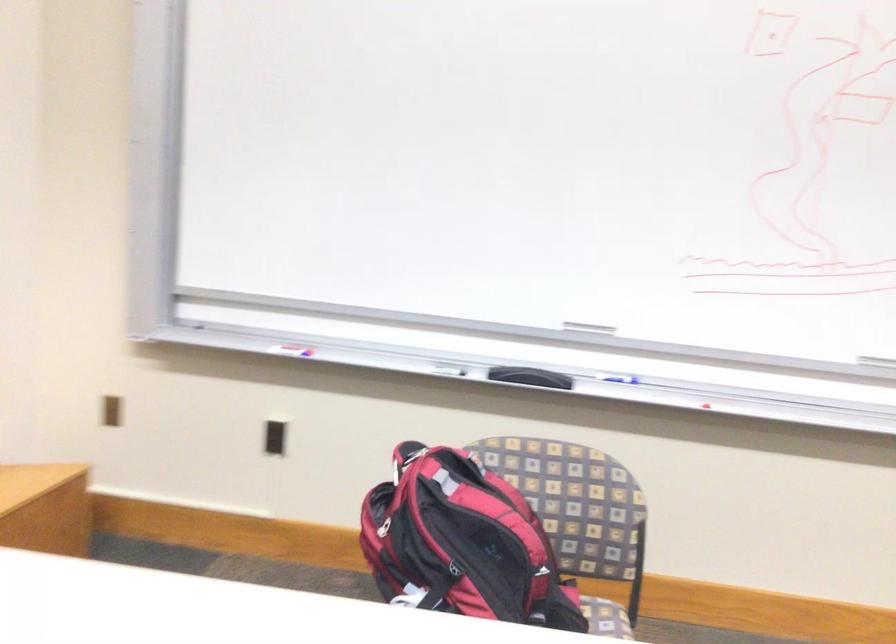
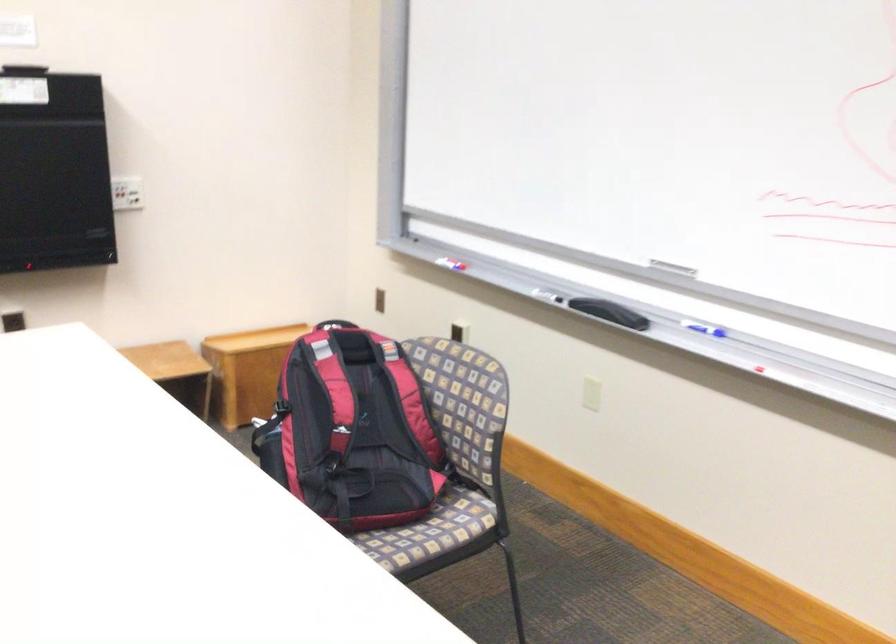
Find the pixel in the second image that matches point (286, 355) in the first image.

(451, 261)